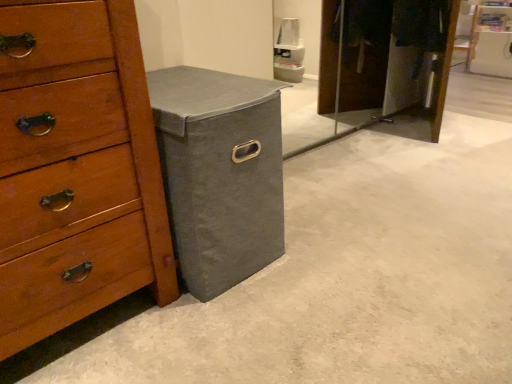
Question: Considering the positions of point (97, 1) and point (202, 92), is point (97, 1) closer or farther from the camera than point (202, 92)?

Choices:
 (A) farther
 (B) closer

Answer: (B)

Question: Is wooden chest of drawers at left bigger or smaller than gray fabric storage bin at lower left?

Choices:
 (A) small
 (B) big

Answer: (B)

Question: From a real-world perspective, is wooden chest of drawers at left above or below gray fabric storage bin at lower left?

Choices:
 (A) above
 (B) below

Answer: (A)

Question: Is gray fabric storage bin at lower left bigger or smaller than wooden chest of drawers at left?

Choices:
 (A) big
 (B) small

Answer: (B)

Question: From a real-world perspective, is gray fabric storage bin at lower left positioned above or below wooden chest of drawers at left?

Choices:
 (A) below
 (B) above

Answer: (A)

Question: Considering the positions of point (250, 135) and point (146, 110), is point (250, 135) closer or farther from the camera than point (146, 110)?

Choices:
 (A) farther
 (B) closer

Answer: (A)

Question: Relative to wooden chest of drawers at left, is gray fabric storage bin at lower left in front or behind?

Choices:
 (A) front
 (B) behind

Answer: (B)